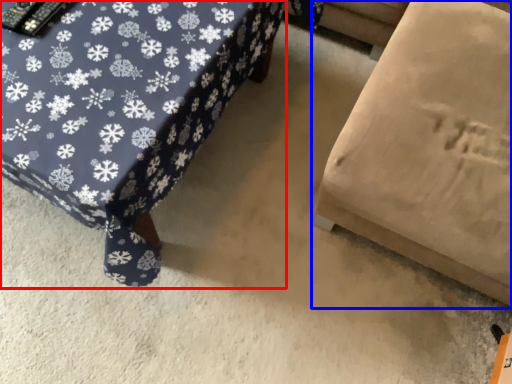
Question: Among these objects, which one is farthest to the camera, furniture (highlighted by a red box) or furniture (highlighted by a blue box)?

Choices:
 (A) furniture
 (B) furniture

Answer: (A)